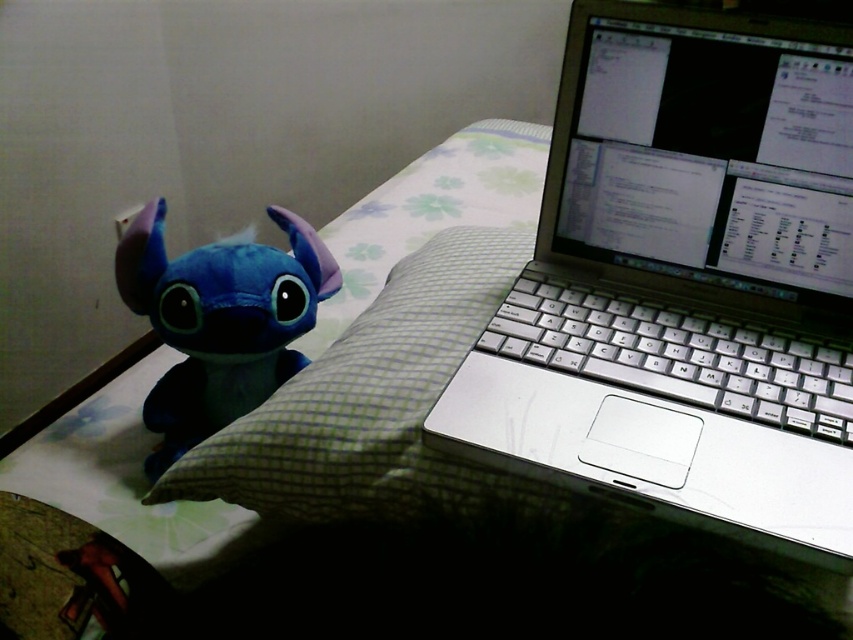
You are trying to place a new book between the silver metallic laptop at upper right and the soft blue plush at left. Based on their positions, where should you place the book to ensure it is between them?

The silver metallic laptop at upper right is above the soft blue plush at left, so to place the book between them, position it below the laptop and above the plush.

You are trying to locate the silver metallic laptop at upper right in the image. What are the coordinates where you can find it?

The silver metallic laptop at upper right can be found at coordinates point [685,280].

You are organizing a small shelf and need to place both the silver metallic laptop at upper right and the soft blue plush at left. If the shelf has limited space and you can only fit one item, which item should you choose to maximize the shelf space usage?

The silver metallic laptop at upper right is larger in size than the soft blue plush at left, so choosing the silver metallic laptop at upper right would maximize the shelf space usage since it occupies more space.